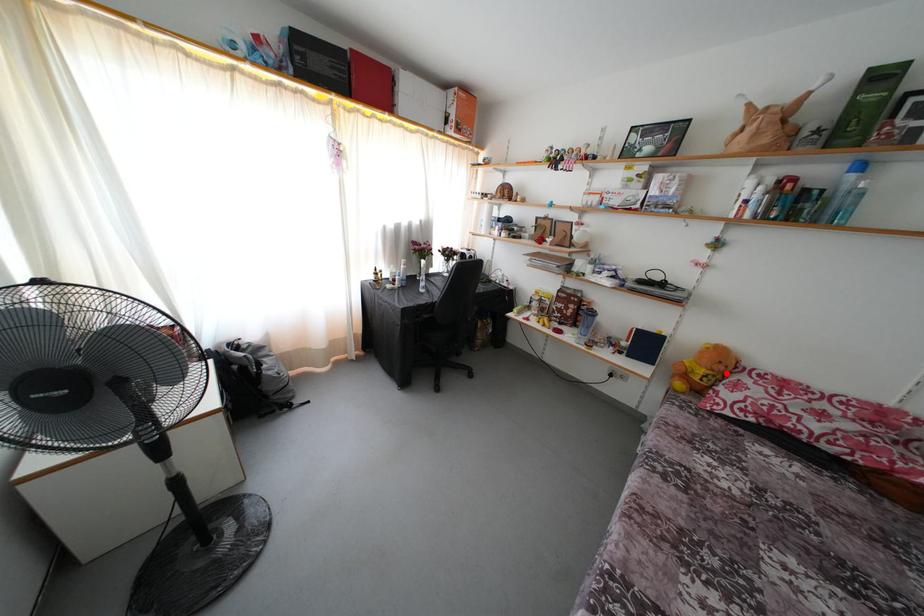
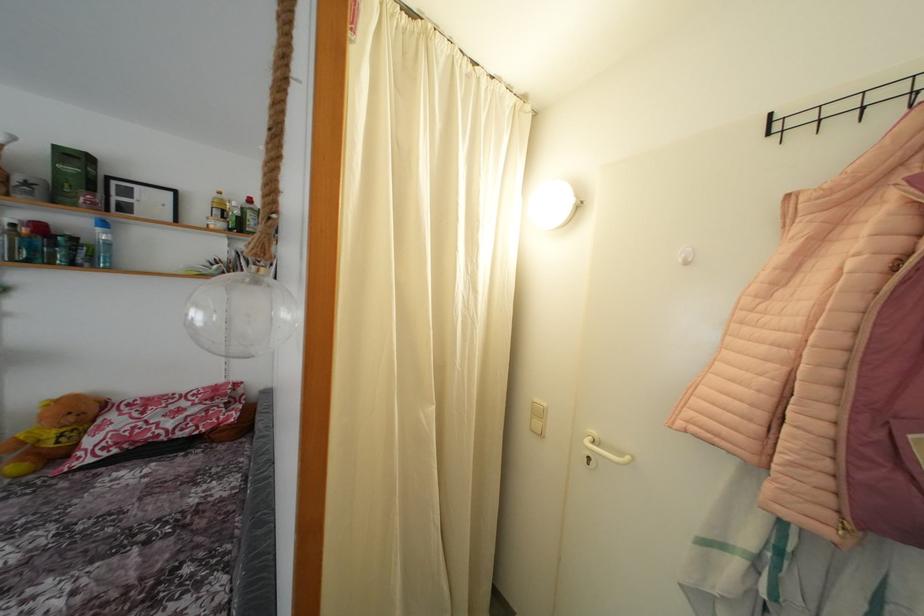
Locate, in the second image, the point that corresponds to the highlighted location in the first image.

(77, 424)